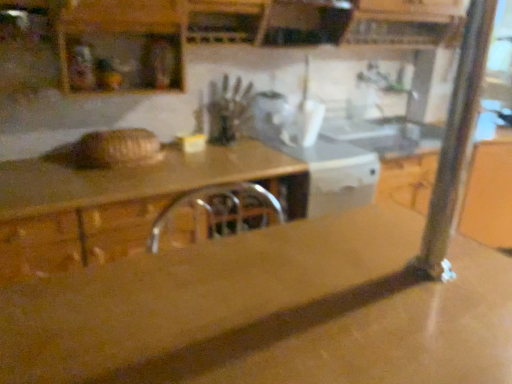
Identify the location of free space above brown polished wood countertop at center (from a real-world perspective). (220, 304).